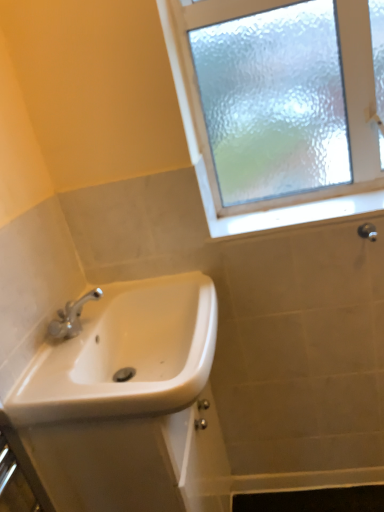
Question: Considering their positions, is frosted glass window at upper right located in front of or behind white ceramic sink at lower left?

Choices:
 (A) front
 (B) behind

Answer: (B)

Question: Looking at their shapes, would you say frosted glass window at upper right is wider or thinner than white ceramic sink at lower left?

Choices:
 (A) thin
 (B) wide

Answer: (A)

Question: Which of these objects is positioned farthest from the white glossy window sill at upper right?

Choices:
 (A) matte silver shower at upper right
 (B) white ceramic sink at lower left
 (C) frosted glass window at upper right

Answer: (B)

Question: Which is nearer to the matte silver shower at upper right?

Choices:
 (A) white glossy window sill at upper right
 (B) white ceramic sink at lower left
 (C) frosted glass window at upper right

Answer: (A)